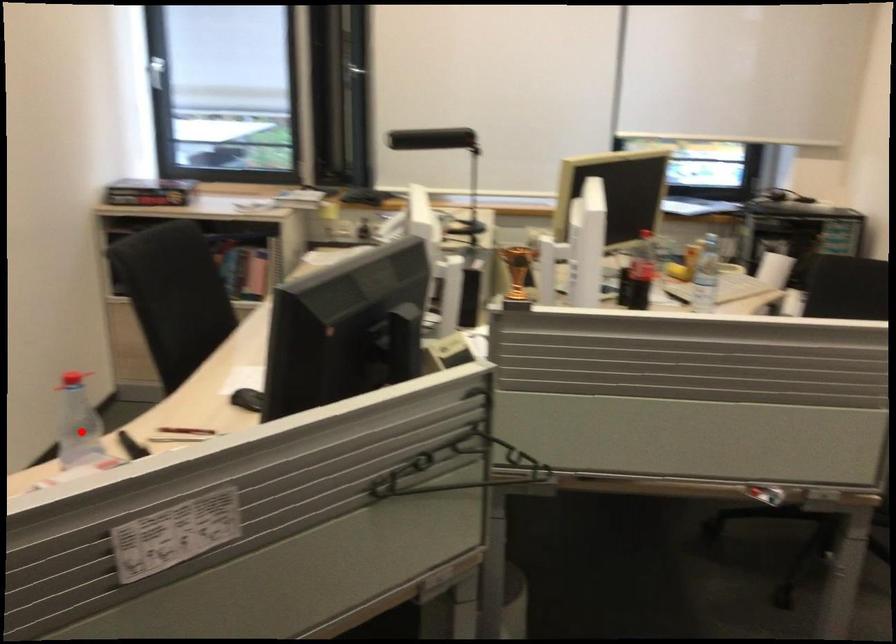
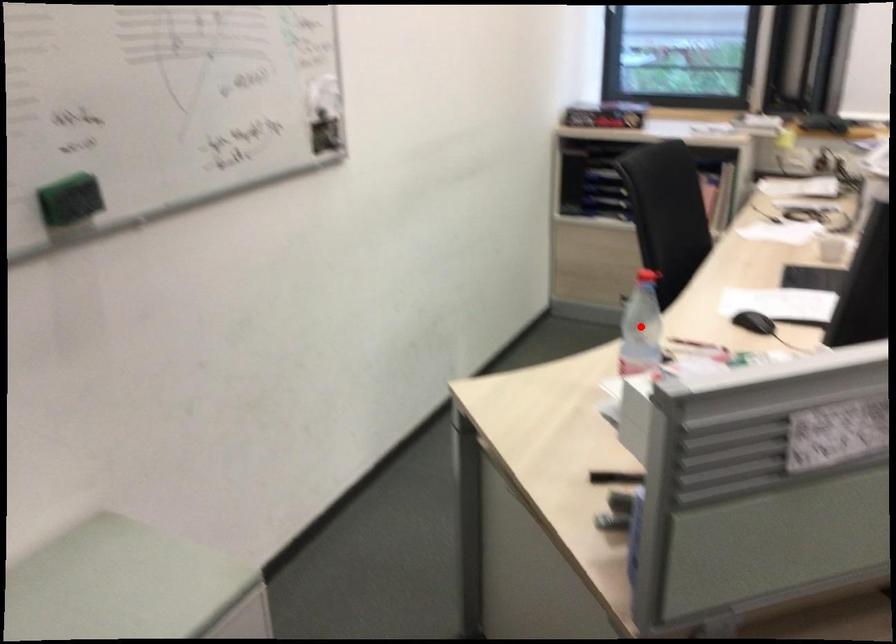
I am providing you with two images of the same scene from different viewpoints. A red point is marked on the first image and another point is marked on the second image. Do the highlighted points in image1 and image2 indicate the same real-world spot?

Yes